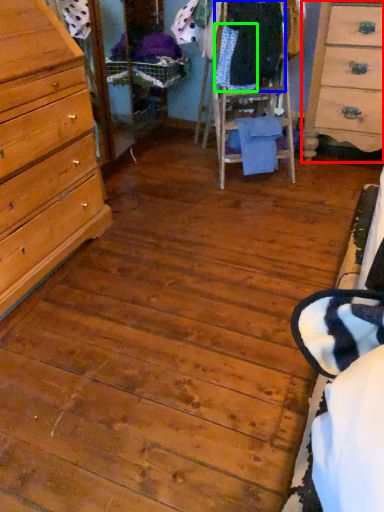
Question: Estimate the real-world distances between objects in this image. Which object is closer to chest of drawers (highlighted by a red box), clothing (highlighted by a blue box) or clothing (highlighted by a green box)?

Choices:
 (A) clothing
 (B) clothing

Answer: (A)